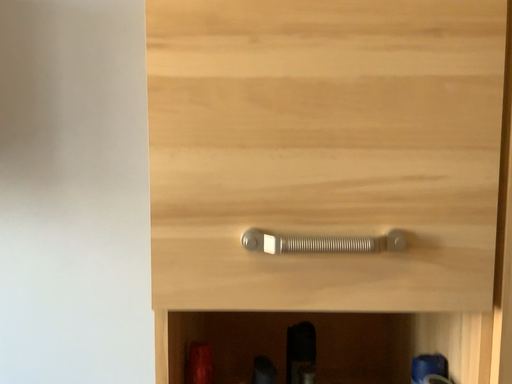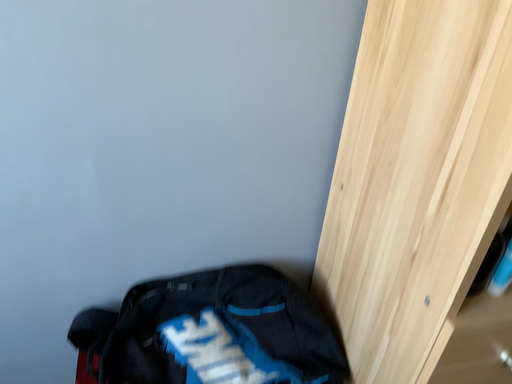
Question: Which way did the camera rotate in the video?

Choices:
 (A) rotated right
 (B) rotated left

Answer: (A)